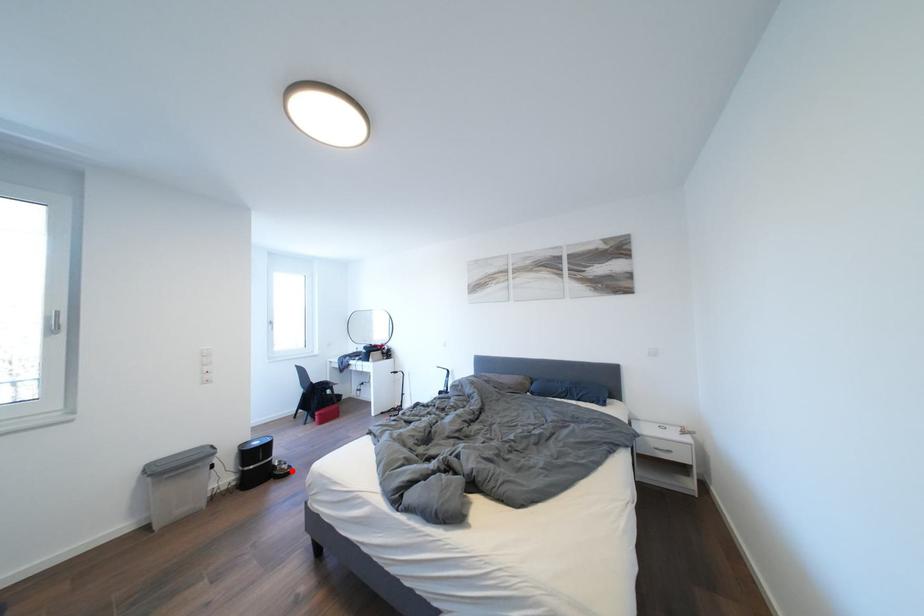
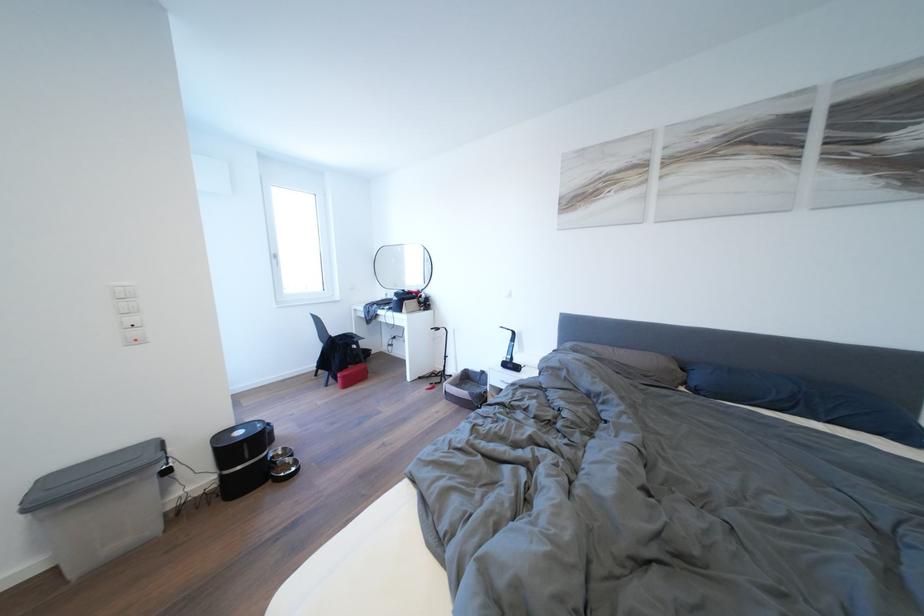
Question: I am providing you with two images of the same scene from different viewpoints. Image1 has a red point marked. In image2, the corresponding 3D location appears at what relative position? Reply with the corresponding letter.

Choices:
 (A) Closer
 (B) Farther

Answer: (B)